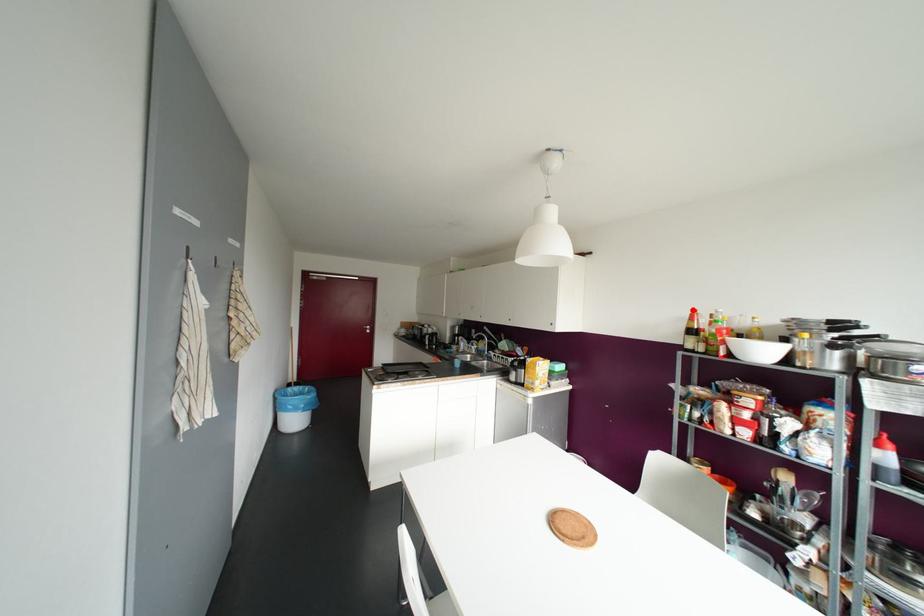
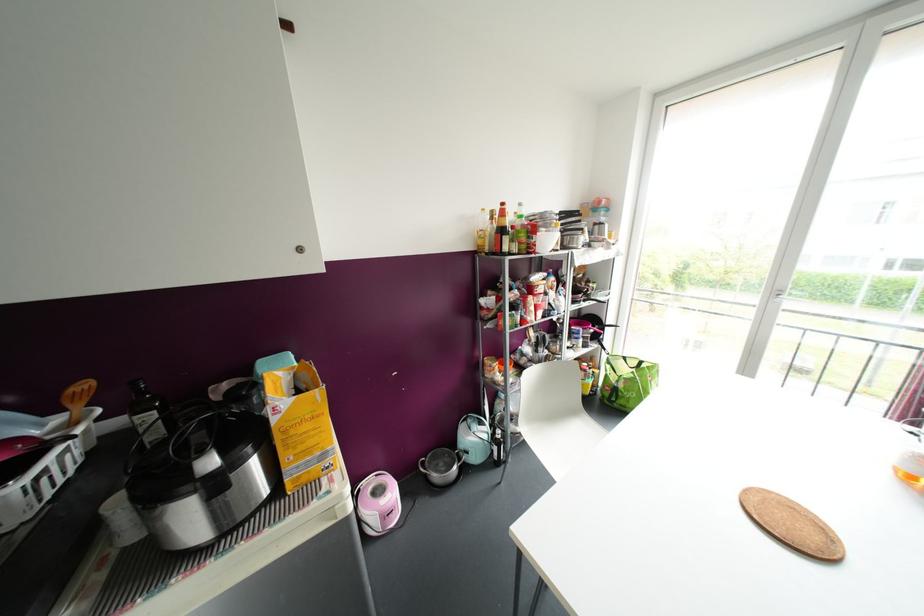
The point at the highlighted location is marked in the first image. Where is the corresponding point in the second image?

(502, 204)